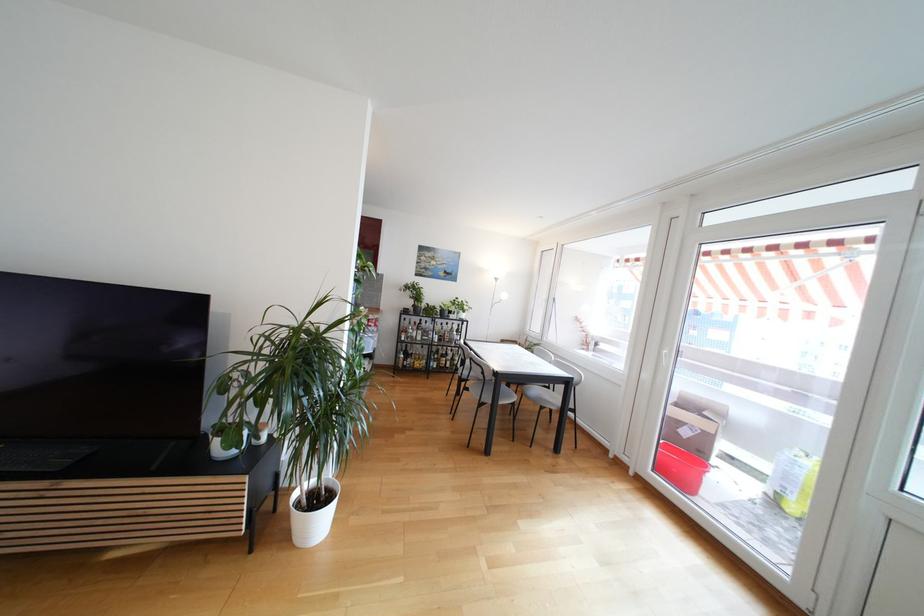
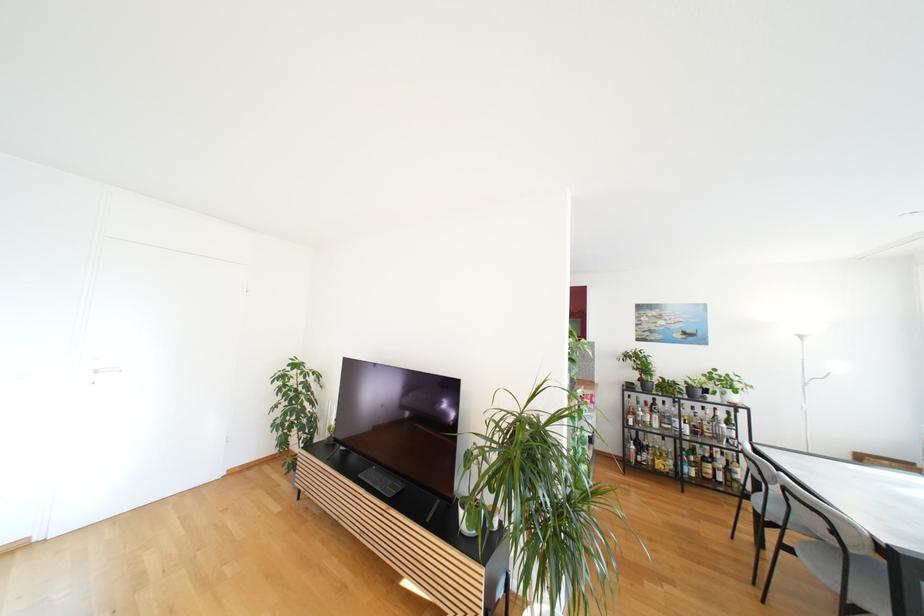
Question: The images are taken continuously from a first-person perspective. In which direction is your viewpoint rotating?

Choices:
 (A) Left
 (B) Right
 (C) Up
 (D) Down

Answer: (A)